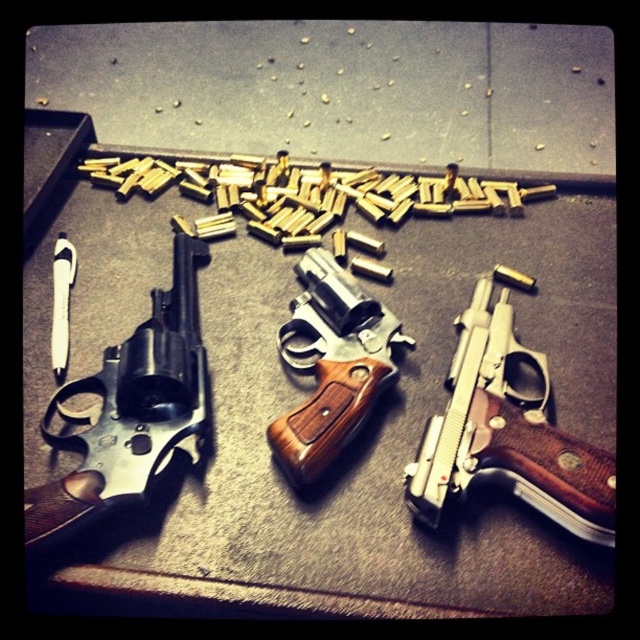
Which is in front, point (184, 371) or point (275, 460)?

Point (184, 371) is in front.

Is point (157, 429) closer to viewer compared to point (328, 445)?

No.

Between point (112, 456) and point (301, 257), which one is positioned in front?

Point (112, 456)

Where is `polished silver revolver at left`? This screenshot has height=640, width=640. polished silver revolver at left is located at coordinates (131, 406).

In the scene shown: Does polished silver revolver at center have a smaller size compared to polished silver revolver at left?

Correct, polished silver revolver at center occupies less space than polished silver revolver at left.

Who is higher up, polished silver revolver at center or polished silver revolver at left?

Positioned higher is polished silver revolver at left.

Which is in front, point (497, 307) or point (67, 394)?

Positioned in front is point (67, 394).

Locate an element on the screen. This screenshot has width=640, height=640. polished silver revolver at center is located at coordinates (508, 435).

Who is more forward, (541,477) or (298,364)?

Point (541,477) is in front.

Can you confirm if polished silver revolver at center is positioned to the left of wooden-handled revolver at center?

No, polished silver revolver at center is not to the left of wooden-handled revolver at center.

The width and height of the screenshot is (640, 640). In order to click on polished silver revolver at center in this screenshot , I will do `click(508, 435)`.